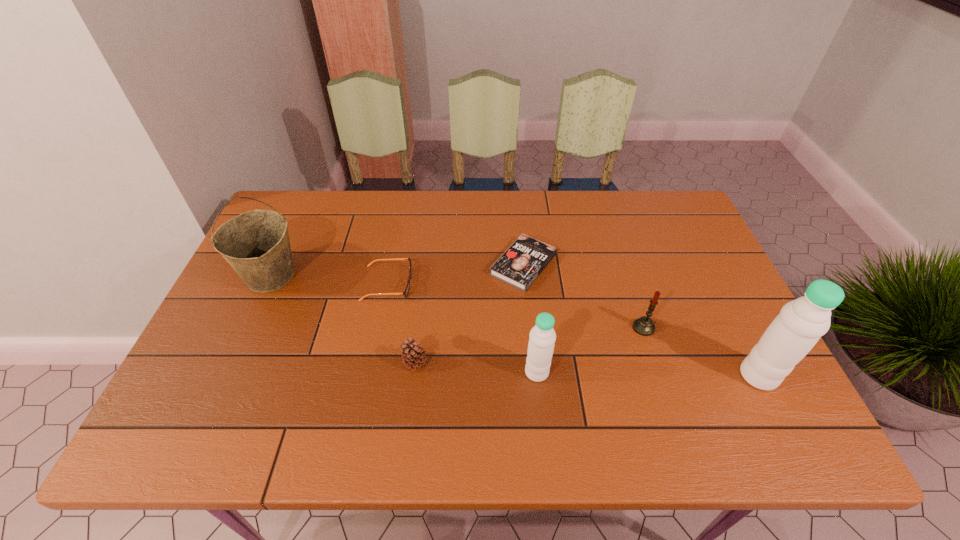
Where is `the fifth object from right to left`? The image size is (960, 540). the fifth object from right to left is located at coordinates (413, 354).

Identify the location of the third shortest object. This screenshot has width=960, height=540. tap(413, 354).

I want to click on vacant space positioned on the back of the third tallest object, so click(x=525, y=262).

This screenshot has width=960, height=540. In order to click on free location located on the back of the taller water bottle in this screenshot , I will do `click(737, 333)`.

Where is `free region located on the front-facing side of the second object from left to right`? Image resolution: width=960 pixels, height=540 pixels. free region located on the front-facing side of the second object from left to right is located at coordinates pos(473,284).

At what (x,y) coordinates should I click in order to perform the action: click on blank area located on the back of the shortest object. Please return your answer as a coordinate pair (x, y). The image size is (960, 540). Looking at the image, I should click on (518, 214).

I want to click on blank space located 0.050m on the back of the fourth shortest object, so click(636, 305).

This screenshot has height=540, width=960. Identify the location of free spot located 0.300m on the back of the wine bucket. (309, 193).

At what (x,y) coordinates should I click in order to perform the action: click on vacant space positioned on the back of the third object from left to right. Please return your answer as a coordinate pair (x, y). Image resolution: width=960 pixels, height=540 pixels. Looking at the image, I should click on (419, 329).

You are a GUI agent. You are given a task and a screenshot of the screen. Output one action in this format:
    pyautogui.click(x=<x>, y=<y>)
    Task: Click on the pinecone situated at the near edge
    The width and height of the screenshot is (960, 540).
    Given the screenshot: What is the action you would take?
    pyautogui.click(x=413, y=354)